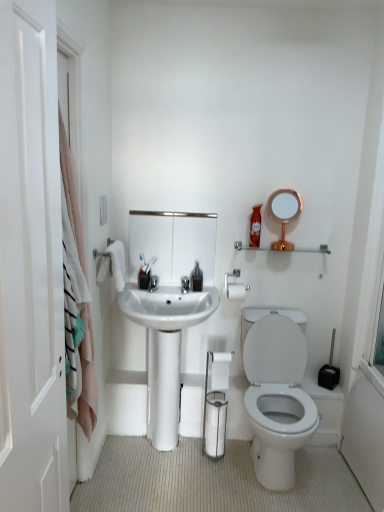
In order to face matte black toothbrush at center, the second toiletry from the top, should I rotate leftwards or rightwards?

It's best to rotate left around 6.358 degrees.

This screenshot has height=512, width=384. Describe the element at coordinates (173, 243) in the screenshot. I see `metallic rectangular mirror at center, which is the 1th mirror in left-to-right order` at that location.

What do you see at coordinates (31, 265) in the screenshot? This screenshot has height=512, width=384. I see `white matte door at left` at bounding box center [31, 265].

Where is `white glossy sink at center`? white glossy sink at center is located at coordinates point(165,349).

You are a GUI agent. You are given a task and a screenshot of the screen. Output one action in this format:
    pyautogui.click(x=<x>, y=<y>)
    Task: Click on the white matte toilet paper at center
    Image resolution: width=384 pixels, height=512 pixels.
    Given the screenshot: What is the action you would take?
    pyautogui.click(x=220, y=370)

From the image's perspective, is pink fabric towel at left above or below matte plastic soap dispenser at upper right, arranged as the first toiletry when viewed from the top?

pink fabric towel at left is situated lower than matte plastic soap dispenser at upper right, arranged as the first toiletry when viewed from the top, in the image.

Does point (80, 229) come farther from viewer compared to point (257, 243)?

No, it is in front of (257, 243).

Can you see pink fabric towel at left touching matte plastic soap dispenser at upper right, which appears as the 2th toiletry when viewed from the left?

There is a gap between pink fabric towel at left and matte plastic soap dispenser at upper right, which appears as the 2th toiletry when viewed from the left.

Is pink fabric towel at left wider or thinner than matte plastic soap dispenser at upper right, the first toiletry positioned from the right?

In the image, pink fabric towel at left appears to be wider than matte plastic soap dispenser at upper right, the first toiletry positioned from the right.

Considering the positions of objects matte black toothbrush at center, positioned as the first toiletry in bottom-to-top order, and rose gold metallic mirror at upper right, acting as the 1th mirror starting from the right, in the image provided, who is more to the right, matte black toothbrush at center, positioned as the first toiletry in bottom-to-top order, or rose gold metallic mirror at upper right, acting as the 1th mirror starting from the right,?

rose gold metallic mirror at upper right, acting as the 1th mirror starting from the right.

Considering the sizes of matte black toothbrush at center, positioned as the first toiletry in bottom-to-top order, and rose gold metallic mirror at upper right, which is the second mirror from left to right, in the image, is matte black toothbrush at center, positioned as the first toiletry in bottom-to-top order, taller or shorter than rose gold metallic mirror at upper right, which is the second mirror from left to right,?

In the image, matte black toothbrush at center, positioned as the first toiletry in bottom-to-top order, appears to be shorter than rose gold metallic mirror at upper right, which is the second mirror from left to right.

Is matte black toothbrush at center, which is the second toiletry from right to left, facing towards rose gold metallic mirror at upper right, acting as the 1th mirror starting from the right?

No, matte black toothbrush at center, which is the second toiletry from right to left, is not facing towards rose gold metallic mirror at upper right, acting as the 1th mirror starting from the right.

Is matte plastic soap dispenser at upper right, which appears as the second toiletry when ordered from the bottom, oriented towards white matte toilet paper at center?

No, matte plastic soap dispenser at upper right, which appears as the second toiletry when ordered from the bottom, is not aimed at white matte toilet paper at center.

Is matte plastic soap dispenser at upper right, which appears as the second toiletry when ordered from the bottom, in contact with white matte toilet paper at center?

No, matte plastic soap dispenser at upper right, which appears as the second toiletry when ordered from the bottom, is not in contact with white matte toilet paper at center.

From the white matte toilet paper at center, count 1st toiletrys backward and point to it. Please provide its 2D coordinates.

[(255, 226)]

Which of these two, matte plastic soap dispenser at upper right, arranged as the first toiletry when viewed from the top, or white matte toilet paper at center, is wider?

With larger width is matte plastic soap dispenser at upper right, arranged as the first toiletry when viewed from the top.

Is matte plastic soap dispenser at upper right, arranged as the first toiletry when viewed from the top, positioned with its back to matte black toothbrush at center, positioned as the first toiletry in bottom-to-top order?

No, matte plastic soap dispenser at upper right, arranged as the first toiletry when viewed from the top,'s orientation is not away from matte black toothbrush at center, positioned as the first toiletry in bottom-to-top order.

From the picture: Considering the relative positions of matte plastic soap dispenser at upper right, which appears as the second toiletry when ordered from the bottom, and matte black toothbrush at center, the second toiletry from the top, in the image provided, is matte plastic soap dispenser at upper right, which appears as the second toiletry when ordered from the bottom, to the left or to the right of matte black toothbrush at center, the second toiletry from the top,?

Clearly, matte plastic soap dispenser at upper right, which appears as the second toiletry when ordered from the bottom, is on the right of matte black toothbrush at center, the second toiletry from the top, in the image.

From the image's perspective, is matte plastic soap dispenser at upper right, the first toiletry positioned from the right, above or below matte black toothbrush at center, which is the second toiletry from right to left?

matte plastic soap dispenser at upper right, the first toiletry positioned from the right, is situated higher than matte black toothbrush at center, which is the second toiletry from right to left, in the image.

Which is nearer, [260,216] or [147,272]?

The point [260,216] is in front.

From the picture: Considering the positions of objects matte black toothbrush at center, the second toiletry from the top, and white matte toilet paper at center in the image provided, who is in front, matte black toothbrush at center, the second toiletry from the top, or white matte toilet paper at center?

Positioned in front is white matte toilet paper at center.

Is white matte toilet paper at center a part of matte black toothbrush at center, the first toiletry when ordered from left to right?

Actually, white matte toilet paper at center is outside matte black toothbrush at center, the first toiletry when ordered from left to right.

Who is taller, matte black toothbrush at center, positioned as the first toiletry in bottom-to-top order, or white matte toilet paper at center?

white matte toilet paper at center.

Which is closer, [147,285] or [225,372]?

The point [225,372] is closer.

Is the depth of rose gold metallic mirror at upper right, which is the second mirror from left to right, greater than that of clear glass shelf at upper center?

No, rose gold metallic mirror at upper right, which is the second mirror from left to right, is closer to the camera.

Is rose gold metallic mirror at upper right, acting as the 1th mirror starting from the right, inside the boundaries of clear glass shelf at upper center, or outside?

The correct answer is: outside.

From the picture: Is rose gold metallic mirror at upper right, acting as the 1th mirror starting from the right, far away from clear glass shelf at upper center?

That's not correct — rose gold metallic mirror at upper right, acting as the 1th mirror starting from the right, is a little close to clear glass shelf at upper center.

Considering the relative sizes of rose gold metallic mirror at upper right, which is the second mirror from left to right, and clear glass shelf at upper center in the image provided, is rose gold metallic mirror at upper right, which is the second mirror from left to right, thinner than clear glass shelf at upper center?

Yes, rose gold metallic mirror at upper right, which is the second mirror from left to right, is thinner than clear glass shelf at upper center.

Does matte plastic soap dispenser at upper right, arranged as the first toiletry when viewed from the top, come behind clear glass shelf at upper center?

No, it is in front of clear glass shelf at upper center.

Is matte plastic soap dispenser at upper right, which appears as the second toiletry when ordered from the bottom, completely or partially outside of clear glass shelf at upper center?

matte plastic soap dispenser at upper right, which appears as the second toiletry when ordered from the bottom, lies outside clear glass shelf at upper center's area.

In the scene shown: Which is more to the right, matte plastic soap dispenser at upper right, which appears as the second toiletry when ordered from the bottom, or clear glass shelf at upper center?

Positioned to the right is clear glass shelf at upper center.

Looking at this image, considering the sizes of matte plastic soap dispenser at upper right, which appears as the 2th toiletry when viewed from the left, and clear glass shelf at upper center in the image, is matte plastic soap dispenser at upper right, which appears as the 2th toiletry when viewed from the left, wider or thinner than clear glass shelf at upper center?

Clearly, matte plastic soap dispenser at upper right, which appears as the 2th toiletry when viewed from the left, has less width compared to clear glass shelf at upper center.

Locate an element on the screen. The height and width of the screenshot is (512, 384). shower curtain below the matte plastic soap dispenser at upper right, the first toiletry positioned from the right (from a real-world perspective) is located at coordinates (87, 379).

Locate an element on the screen. Image resolution: width=384 pixels, height=512 pixels. the 2nd toiletry behind when counting from the rose gold metallic mirror at upper right, acting as the 1th mirror starting from the right is located at coordinates (144, 279).

Based on their spatial positions, is matte black toothbrush at center, the second toiletry from the top, or white matte toilet paper at center further from white matte door at left?

white matte toilet paper at center is further to white matte door at left.

Considering their positions, is white matte toilet paper at center positioned closer to white glossy sink at center than matte plastic soap dispenser at upper right, the first toiletry positioned from the right?

The object closer to white glossy sink at center is white matte toilet paper at center.

Considering their positions, is white glossy sink at center positioned closer to clear glass shelf at upper center than white matte toilet paper at center?

The object closer to clear glass shelf at upper center is white glossy sink at center.

When comparing their distances from rose gold metallic mirror at upper right, acting as the 1th mirror starting from the right, does white glossy sink at center or clear glass shelf at upper center seem further?

Based on the image, white glossy sink at center appears to be further to rose gold metallic mirror at upper right, acting as the 1th mirror starting from the right.

Considering their positions, is white glossy sink at center positioned further to white matte door at left than metallic rectangular mirror at center, positioned as the 2th mirror in right-to-left order?

Among the two, metallic rectangular mirror at center, positioned as the 2th mirror in right-to-left order, is located further to white matte door at left.

From the image, which object appears to be farther from matte black toothbrush at center, positioned as the first toiletry in bottom-to-top order, silver metallic towel bar at upper center or clear glass shelf at upper center?

Among the two, clear glass shelf at upper center is located further to matte black toothbrush at center, positioned as the first toiletry in bottom-to-top order.

Based on their spatial positions, is matte black toothbrush at center, positioned as the first toiletry in bottom-to-top order, or rose gold metallic mirror at upper right, which is the second mirror from left to right, closer to white glossy sink at center?

matte black toothbrush at center, positioned as the first toiletry in bottom-to-top order, lies closer to white glossy sink at center than the other object.

When comparing their distances from matte plastic soap dispenser at upper right, which appears as the 2th toiletry when viewed from the left, does white matte door at left or clear glass shelf at upper center seem further?

Based on the image, white matte door at left appears to be further to matte plastic soap dispenser at upper right, which appears as the 2th toiletry when viewed from the left.

Where is `sink located between pink fabric towel at left and white matte toilet paper at center in the depth direction`? Image resolution: width=384 pixels, height=512 pixels. sink located between pink fabric towel at left and white matte toilet paper at center in the depth direction is located at coordinates coord(165,349).

Locate an element on the screen. The image size is (384, 512). mirror located between pink fabric towel at left and clear glass shelf at upper center in the depth direction is located at coordinates (284, 213).

Where is `balustrade between metallic rectangular mirror at center, which is the 1th mirror in left-to-right order, and white matte toilet paper at center, in the vertical direction`? This screenshot has width=384, height=512. balustrade between metallic rectangular mirror at center, which is the 1th mirror in left-to-right order, and white matte toilet paper at center, in the vertical direction is located at coordinates (284, 248).

This screenshot has width=384, height=512. In order to click on towel bar situated between matte black toothbrush at center, the second toiletry from the top, and rose gold metallic mirror at upper right, which is the second mirror from left to right, from left to right in this screenshot , I will do `click(235, 287)`.